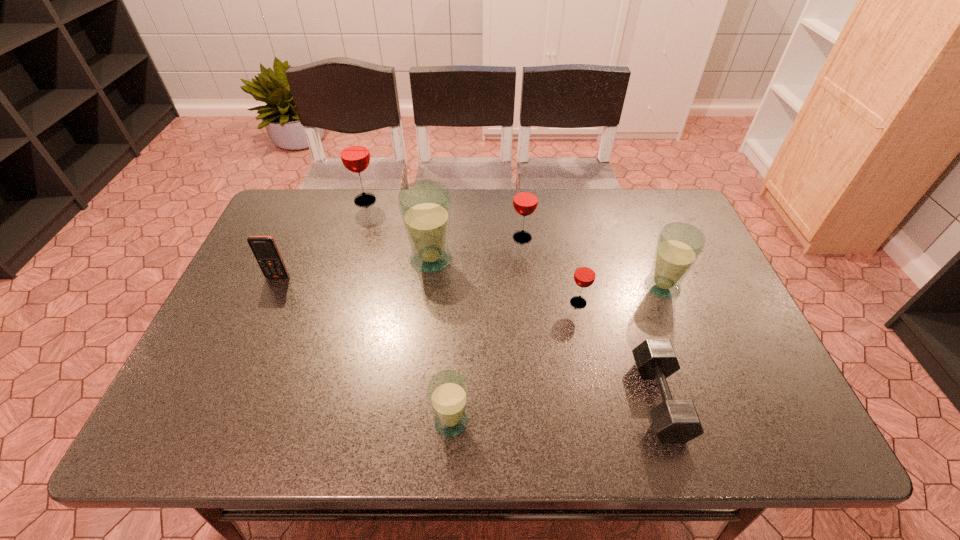
In order to click on free space at the far left corner of the desktop in this screenshot , I will do `click(302, 233)`.

The height and width of the screenshot is (540, 960). In the image, there is a desktop. Identify the location of free space at the far right corner. (683, 219).

I want to click on vacant space in between the cellular telephone and the second object from right to left, so click(x=468, y=338).

At what (x,y) coordinates should I click in order to perform the action: click on free space between the nearest blue glass and the seventh object from left to right. Please return your answer as a coordinate pair (x, y). The height and width of the screenshot is (540, 960). Looking at the image, I should click on (555, 410).

Where is `vacant area that lies between the biggest blue glass and the second object from left to right`? The width and height of the screenshot is (960, 540). vacant area that lies between the biggest blue glass and the second object from left to right is located at coordinates (398, 230).

The image size is (960, 540). I want to click on blank region between the fifth glass from left to right and the dumbbell, so click(619, 351).

The width and height of the screenshot is (960, 540). Find the location of `vacant point located between the second smallest red glass and the cellular telephone`. vacant point located between the second smallest red glass and the cellular telephone is located at coordinates (400, 257).

Where is `empty space that is in between the second object from right to left and the second smallest red glass`? empty space that is in between the second object from right to left and the second smallest red glass is located at coordinates (590, 319).

The image size is (960, 540). Identify the location of free area in between the biggest blue glass and the smallest blue glass. (441, 341).

Locate an element on the screen. The width and height of the screenshot is (960, 540). free space between the rightmost object and the farthest object is located at coordinates (514, 244).